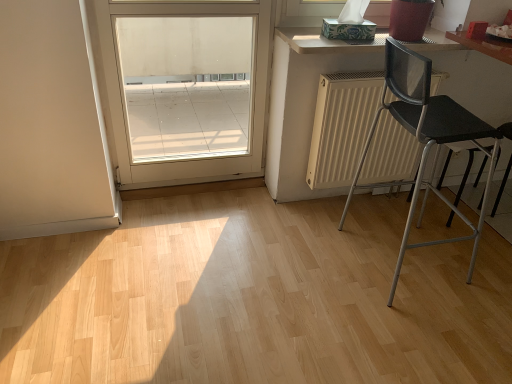
Question: Is light wood countertop at upper right at the left side of white glossy door at upper left?

Choices:
 (A) yes
 (B) no

Answer: (B)

Question: Considering the relative positions of light wood countertop at upper right and white glossy door at upper left in the image provided, is light wood countertop at upper right behind white glossy door at upper left?

Choices:
 (A) yes
 (B) no

Answer: (A)

Question: Considering the relative sizes of light wood countertop at upper right and white glossy door at upper left in the image provided, is light wood countertop at upper right smaller than white glossy door at upper left?

Choices:
 (A) yes
 (B) no

Answer: (A)

Question: Can you confirm if light wood countertop at upper right is thinner than white glossy door at upper left?

Choices:
 (A) no
 (B) yes

Answer: (A)

Question: Does light wood countertop at upper right have a lesser height compared to white glossy door at upper left?

Choices:
 (A) no
 (B) yes

Answer: (B)

Question: Is light wood countertop at upper right completely or partially outside of white glossy door at upper left?

Choices:
 (A) yes
 (B) no

Answer: (A)

Question: Is white glossy door at upper left further to camera compared to white matte radiator at center?

Choices:
 (A) no
 (B) yes

Answer: (A)

Question: Is white glossy door at upper left at the right side of white matte radiator at center?

Choices:
 (A) yes
 (B) no

Answer: (B)

Question: From a real-world perspective, is white glossy door at upper left positioned under white matte radiator at center based on gravity?

Choices:
 (A) yes
 (B) no

Answer: (B)

Question: Are white glossy door at upper left and white matte radiator at center far apart?

Choices:
 (A) no
 (B) yes

Answer: (B)

Question: Considering the relative positions of white glossy door at upper left and white matte radiator at center in the image provided, is white glossy door at upper left to the left of white matte radiator at center from the viewer's perspective?

Choices:
 (A) yes
 (B) no

Answer: (A)

Question: Considering the relative sizes of white glossy door at upper left and white matte radiator at center in the image provided, is white glossy door at upper left shorter than white matte radiator at center?

Choices:
 (A) yes
 (B) no

Answer: (B)

Question: Considering the relative positions of light wood countertop at upper right and black mesh chair at right in the image provided, is light wood countertop at upper right behind black mesh chair at right?

Choices:
 (A) yes
 (B) no

Answer: (A)